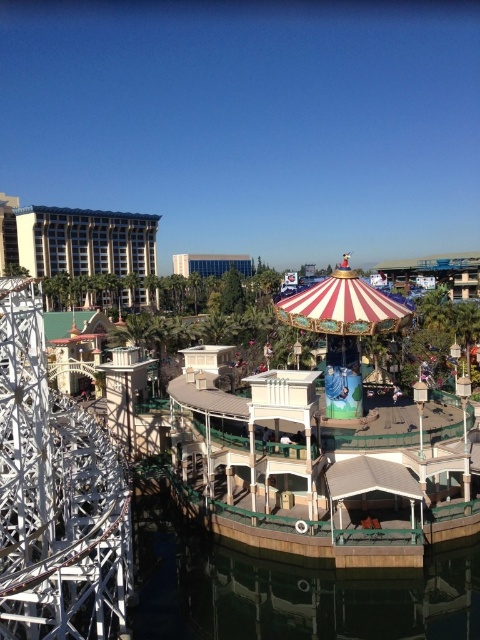
You are standing at the entrance of the theme park and want to find the brown wood water at lower center. According to the map coordinates, where should you look to locate it?

The brown wood water at lower center is located at coordinates point [290,595].

You are standing at the entrance of the theme park and see two points in the image, point (199, 596) and point (357, 387). Which point is nearer to you?

Point (199, 596) is closer to the camera than point (357, 387), so it is nearer to you.

You are a visitor at the theme park and want to take a photo that includes both the brown wood water at lower center and the striped fabric carousel at center. Which object should you position closer to the edge of the frame to ensure both fit in the shot?

Since the brown wood water at lower center is wider than the striped fabric carousel at center, you should position the brown wood water at lower center closer to the edge of the frame to ensure both fit in the shot.